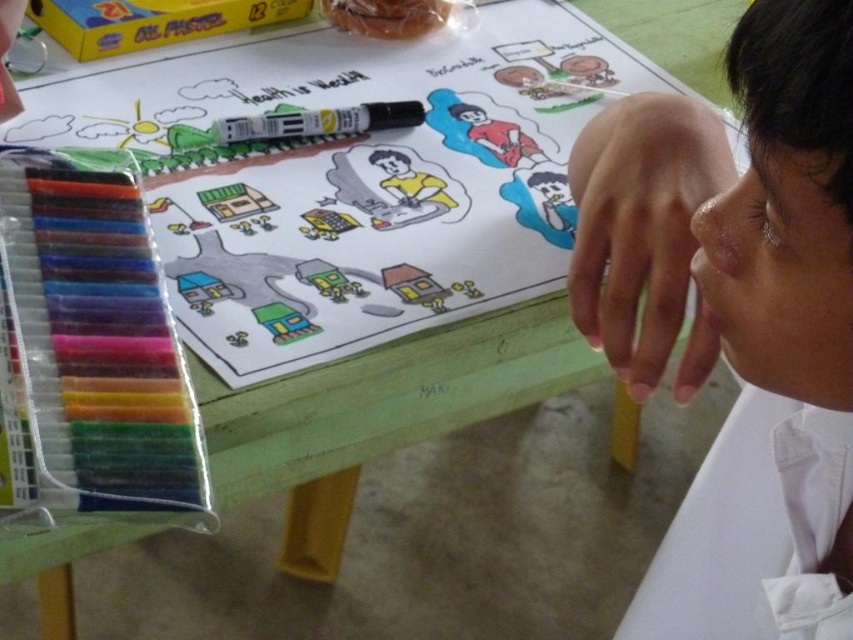
You are a teacher observing a child working on a drawing. The child has a white smooth skin at upper right and a black matte marker at center. Which object is bigger?

The white smooth skin at upper right is larger than the black matte marker at center.

You are a teacher observing a child drawing on a green table. The child has a hand visible while using a black marker. There is a transparent plastic package of colored markers on the left side of the table and a white smooth skin at upper right. Where is the white smooth skin located in relation to the other objects?

The white smooth skin at upper right is located at point coordinates approximately 0.502 in the x and 0.866 in the y axis, as per the provided description.

You are an art teacher observing the child at the green table. You notice the white smooth skin at upper right and the black matte marker at center. Which object is positioned lower in the image?

→ The white smooth skin at upper right is located below the black matte marker at center, so the white smooth skin at upper right is positioned lower in the image.